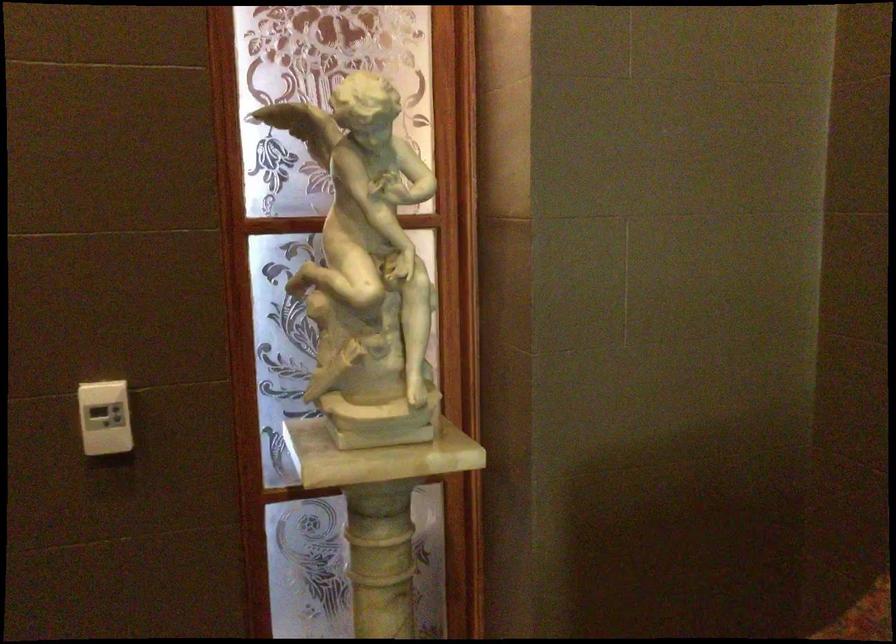
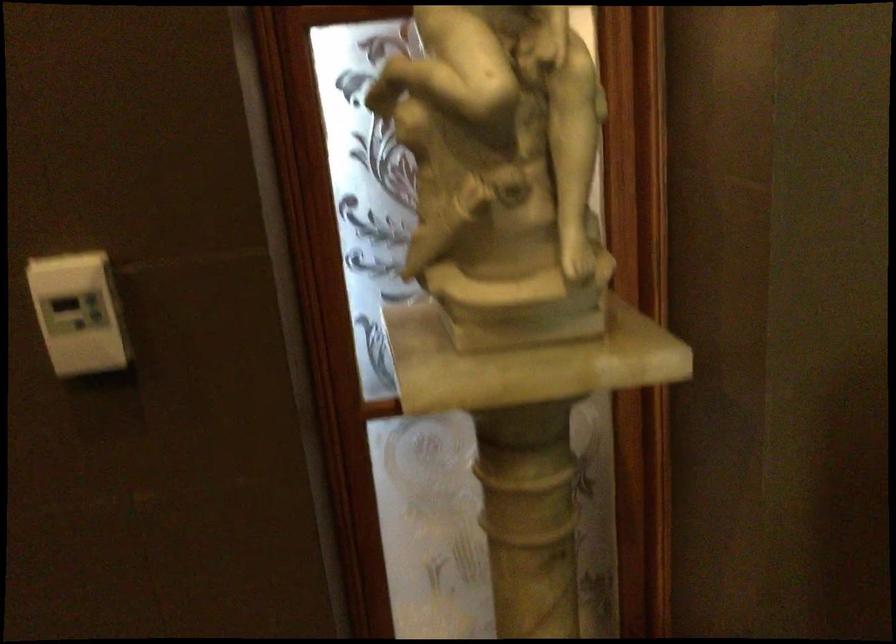
Question: The camera is either moving clockwise (left) or counter-clockwise (right) around the object. The first image is from the beginning of the video and the second image is from the end. Is the camera moving left or right when shooting the video?

Choices:
 (A) Left
 (B) Right

Answer: (B)